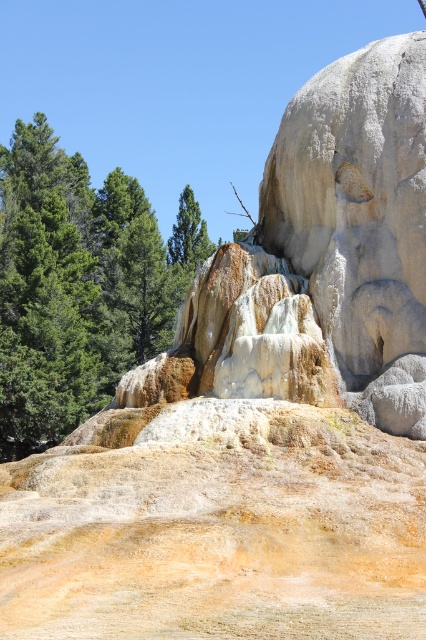
Question: Is green textured pine trees at left above green matte tree at center?

Choices:
 (A) yes
 (B) no

Answer: (B)

Question: Which of the following is the closest to the observer?

Choices:
 (A) green matte tree at center
 (B) green textured pine trees at left

Answer: (B)

Question: Is green textured pine trees at left below green matte tree at center?

Choices:
 (A) yes
 (B) no

Answer: (A)

Question: In this image, where is green textured pine trees at left located relative to green matte tree at center?

Choices:
 (A) below
 (B) above

Answer: (A)

Question: Which object is farther from the camera taking this photo?

Choices:
 (A) green matte tree at center
 (B) green textured pine trees at left

Answer: (A)

Question: Which point is farther to the camera?

Choices:
 (A) green textured pine trees at left
 (B) green matte tree at center

Answer: (B)